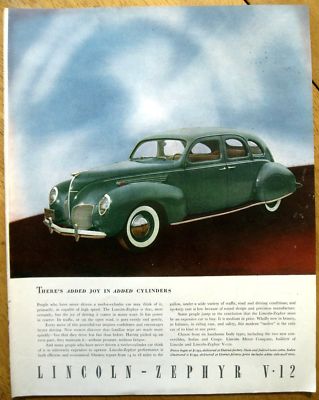
Image resolution: width=319 pixels, height=400 pixels. I want to click on windows, so click(207, 159).